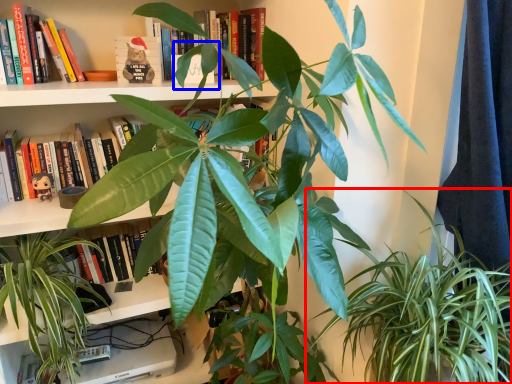
Question: Among these objects, which one is nearest to the camera, houseplant (highlighted by a red box) or leaf (highlighted by a blue box)?

Choices:
 (A) houseplant
 (B) leaf

Answer: (A)